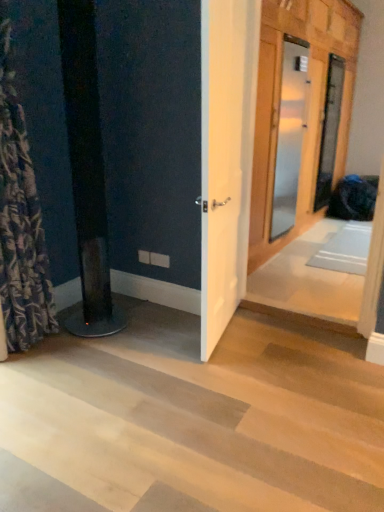
Question: Could you tell me if patterned fabric shower curtain at left is turned towards white wood door at center?

Choices:
 (A) yes
 (B) no

Answer: (B)

Question: Does patterned fabric shower curtain at left lie behind white wood door at center?

Choices:
 (A) no
 (B) yes

Answer: (A)

Question: Is patterned fabric shower curtain at left in front of white wood door at center?

Choices:
 (A) yes
 (B) no

Answer: (A)

Question: Does patterned fabric shower curtain at left have a greater width compared to white wood door at center?

Choices:
 (A) yes
 (B) no

Answer: (A)

Question: From the image's perspective, does patterned fabric shower curtain at left appear higher than white wood door at center?

Choices:
 (A) no
 (B) yes

Answer: (A)

Question: From the image's perspective, is patterned fabric shower curtain at left beneath white wood door at center?

Choices:
 (A) no
 (B) yes

Answer: (B)

Question: Can you confirm if white wood door at center is thinner than patterned fabric shower curtain at left?

Choices:
 (A) no
 (B) yes

Answer: (B)

Question: Does white wood door at center touch patterned fabric shower curtain at left?

Choices:
 (A) no
 (B) yes

Answer: (A)

Question: Does white wood door at center have a smaller size compared to patterned fabric shower curtain at left?

Choices:
 (A) no
 (B) yes

Answer: (B)

Question: Can we say white wood door at center lies outside patterned fabric shower curtain at left?

Choices:
 (A) yes
 (B) no

Answer: (A)

Question: Would you say white wood door at center is a long distance from patterned fabric shower curtain at left?

Choices:
 (A) no
 (B) yes

Answer: (B)

Question: Is white wood door at center positioned before patterned fabric shower curtain at left?

Choices:
 (A) yes
 (B) no

Answer: (B)

Question: From the image's perspective, is patterned fabric shower curtain at left located above wooden door at center, marked as the first door in a right-to-left arrangement?

Choices:
 (A) no
 (B) yes

Answer: (A)